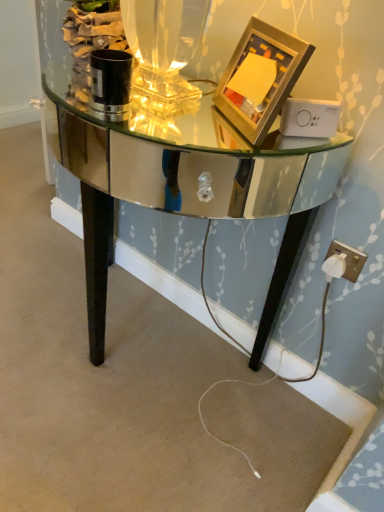
Question: Considering the positions of point (105, 233) and point (271, 27), is point (105, 233) closer or farther from the camera than point (271, 27)?

Choices:
 (A) farther
 (B) closer

Answer: (A)

Question: Is mirrored glass table at center in front of or behind gold metallic picture frame at upper right in the image?

Choices:
 (A) front
 (B) behind

Answer: (A)

Question: Which is nearer to the white plastic plug at lower right?

Choices:
 (A) mirrored glass table at center
 (B) gold metallic picture frame at upper right
 (C) white plastic plug at lower right

Answer: (C)

Question: Estimate the real-world distances between objects in this image. Which object is farther from the gold metallic picture frame at upper right?

Choices:
 (A) white plastic plug at lower right
 (B) mirrored glass table at center
 (C) white plastic plug at lower right

Answer: (C)